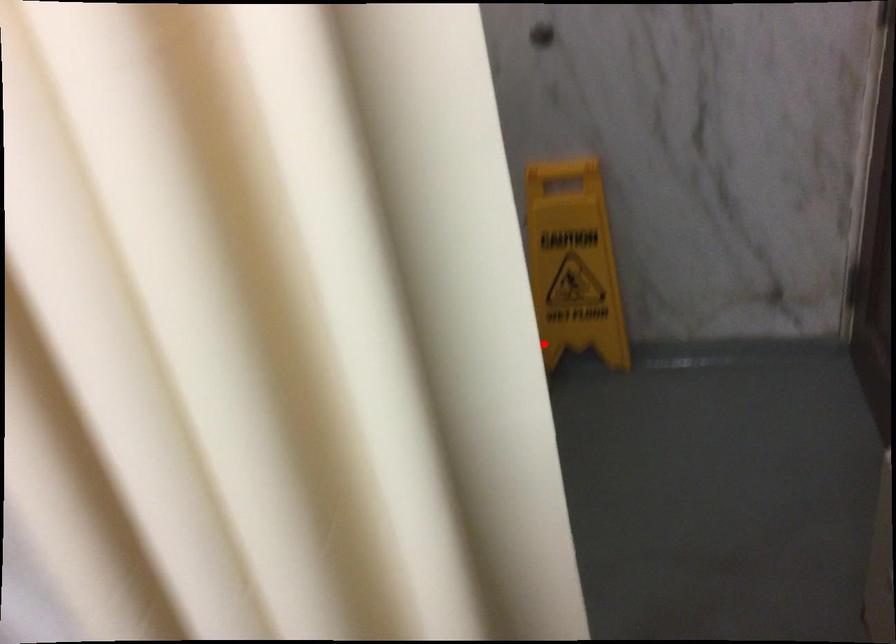
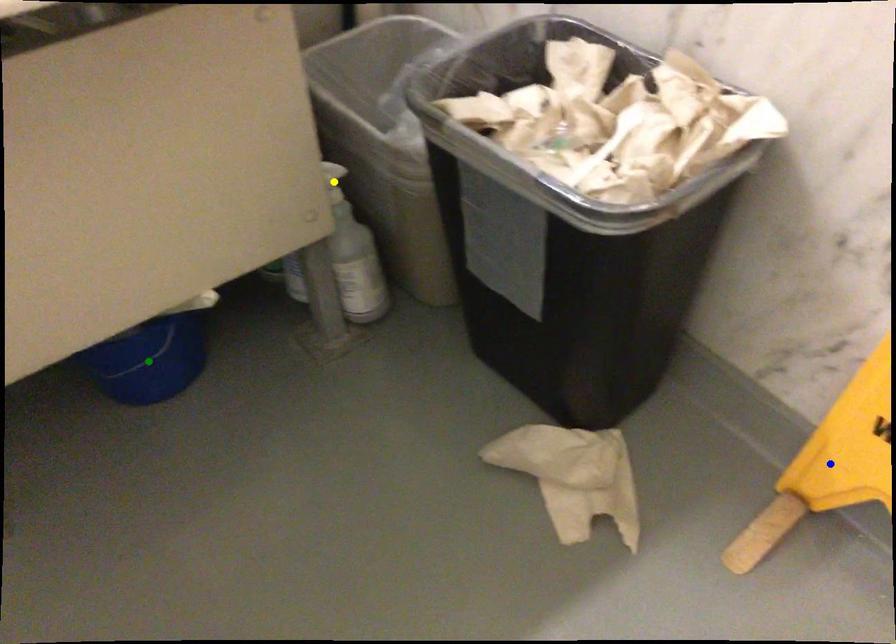
Question: I am providing you with two images of the same scene from different viewpoints. A red point is marked on the first image. You are given multiple points on the second image. Which spot in image 2 lines up with the point in image 1?

Choices:
 (A) yellow point
 (B) green point
 (C) blue point

Answer: (C)